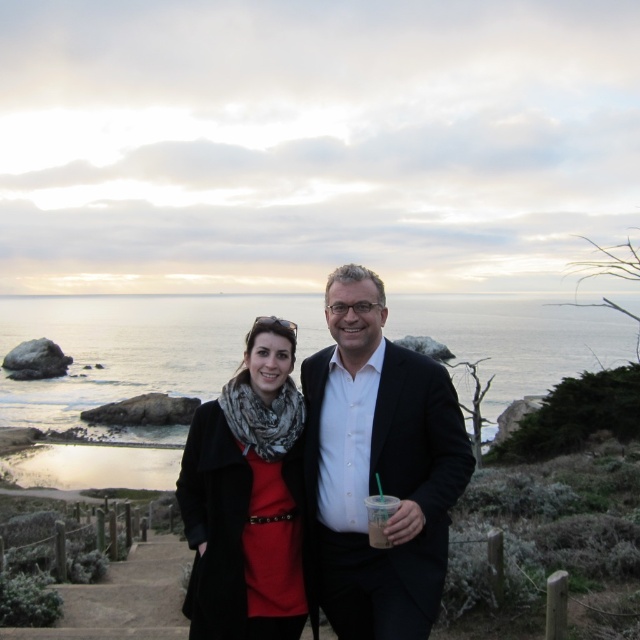
Question: Does clear water at center have a greater width compared to matte black suit at center?

Choices:
 (A) yes
 (B) no

Answer: (A)

Question: Which point appears closest to the camera in this image?

Choices:
 (A) (320, 362)
 (B) (374, 522)
 (C) (289, 502)
 (D) (182, 321)

Answer: (B)

Question: Which of these objects is positioned closest to the matte black coat at center?

Choices:
 (A) matte black suit at center
 (B) clear water at center
 (C) translucent plastic cup at center

Answer: (A)

Question: Can you confirm if clear water at center is positioned below matte black coat at center?

Choices:
 (A) no
 (B) yes

Answer: (A)

Question: Estimate the real-world distances between objects in this image. Which object is closer to the translucent plastic cup at center?

Choices:
 (A) clear water at center
 (B) matte black coat at center
 (C) matte black suit at center

Answer: (C)

Question: Can you confirm if clear water at center is thinner than translucent plastic cup at center?

Choices:
 (A) no
 (B) yes

Answer: (A)